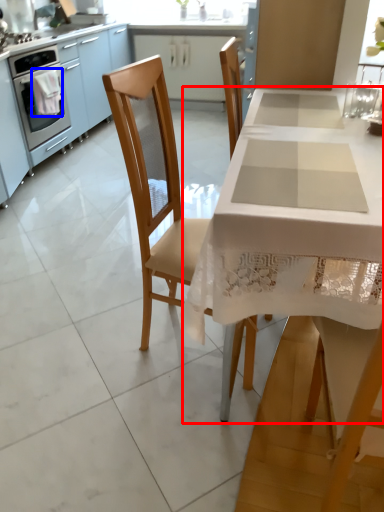
Question: Which of the following is the farthest to the observer, table (highlighted by a red box) or cloth (highlighted by a blue box)?

Choices:
 (A) table
 (B) cloth

Answer: (B)